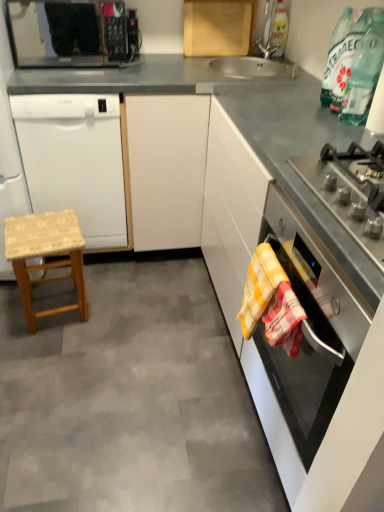
Question: From a real-world perspective, is yellow checkered towel at lower right, arranged as the first blanket when viewed from the front, above or below transparent glass bottle at upper right?

Choices:
 (A) above
 (B) below

Answer: (B)

Question: Looking at their shapes, would you say yellow checkered towel at lower right, arranged as the first blanket when viewed from the front, is wider or thinner than transparent glass bottle at upper right?

Choices:
 (A) thin
 (B) wide

Answer: (B)

Question: Estimate the real-world distances between objects in this image. Which object is closer to the satin silver gas stove at right?

Choices:
 (A) black glass oven at right
 (B) transparent glass bottle at upper right
 (C) wooden cutting board at upper center
 (D) yellow checkered towel at lower right, the second blanket when ordered from front to back
 (E) white matte dishwasher at left

Answer: (A)

Question: Considering the real-world distances, which object is closest to the black glass oven at right?

Choices:
 (A) yellow checkered towel at lower right, arranged as the first blanket when viewed from the front
 (B) black matte microwave at upper left
 (C) woven wood stool at lower left
 (D) yellow checkered towel at lower right, which is the first blanket in back-to-front order
 (E) transparent glass bottle at upper right

Answer: (D)